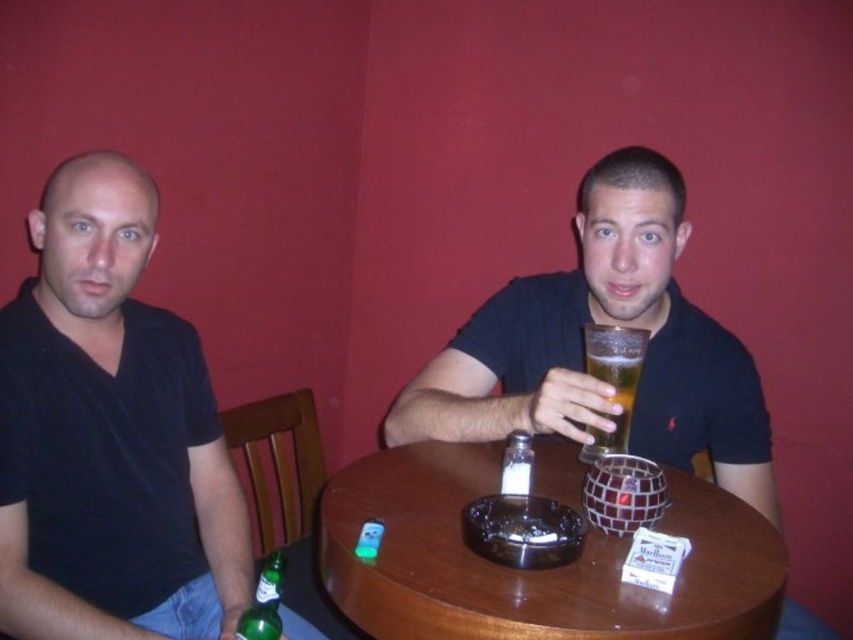
You are a photographer trying to capture a clear shot of both the matte black shirt at center and the golden glass beer at center. Since the camera can only focus on one object at a time, which object should you choose to ensure the larger one is in focus?

The matte black shirt at center is larger in size than the golden glass beer at center, so you should focus on the matte black shirt at center to ensure the larger object is in focus.

You are a photographer standing in front of the scene described. You want to take a closeup shot of the matte black shirt at center without including any other objects in the frame. Given that your camera has a focal length of 50mm, can you determine if you need to move closer or farther away from the subject to achieve this?

The matte black shirt at center is 1.04 meters away from the camera. To take a closeup without including other objects, you would need to adjust your distance based on the camera sensor size and subject size. However, since the shirt is already at center and the description doesn not mention other objects obstructing the shot, moving closer might include more of the shirt but could also bring other items into frame. Alternatively, staying at 1.04 meters might keep the shirt centered while excluding nearby

You are a bartender who needs to place a 6.5 inch long cocktail shaker on the table between the matte black shirt at center and the golden glass beer at center. Is there enough space for it?

The matte black shirt at center is 7.24 inches away from the golden glass beer at center, so yes, the 6.5 inch cocktail shaker can fit between them since the distance between the two objects is greater than the shaker length.